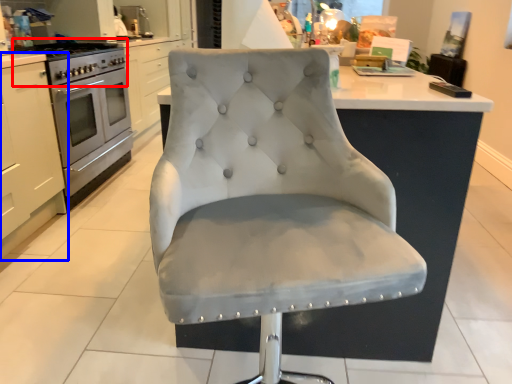
Question: Which point is closer to the camera, gas stove (highlighted by a red box) or cabinetry (highlighted by a blue box)?

Choices:
 (A) gas stove
 (B) cabinetry

Answer: (B)